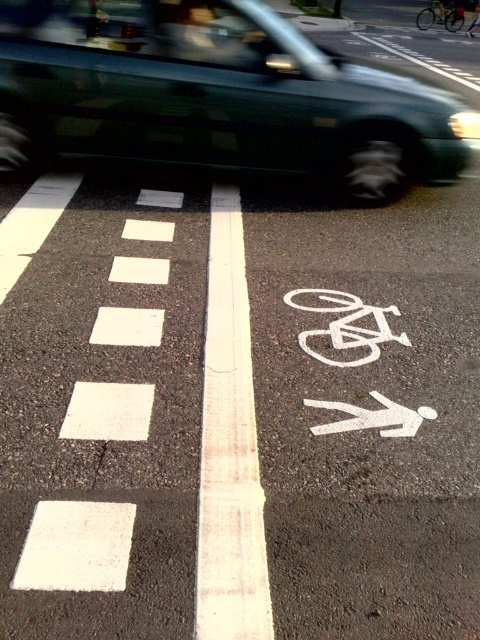
You are a drone operator flying a drone above the road. You need to capture two points on the road for a survey. The points are labeled as point 1 at coordinate point (265, 330) and point 2 at coordinate point (432, 24). Which point is closer to your drone when it is hovering directly above the road?

Point 1 at coordinate point (265, 330) is closer to the camera than point 2 at coordinate point (432, 24), so the drone would capture point 1 first as it is nearer.

You are a delivery driver approaching a road section with a green metallic van at upper center. You need to park your vehicle 12 feet away from the van. Is there enough space between your current position and the van to park safely?

The green metallic van at upper center is 15.00 feet away from the camera. Since you need to park 12 feet away, there is 3 feet of extra space, so yes, there is enough space to park safely.

You are a cyclist approaching the white painted bike lane at center and the green metallic van at upper center. Which object is taller from your perspective?

The white painted bike lane at center is much taller than the green metallic van at upper center.